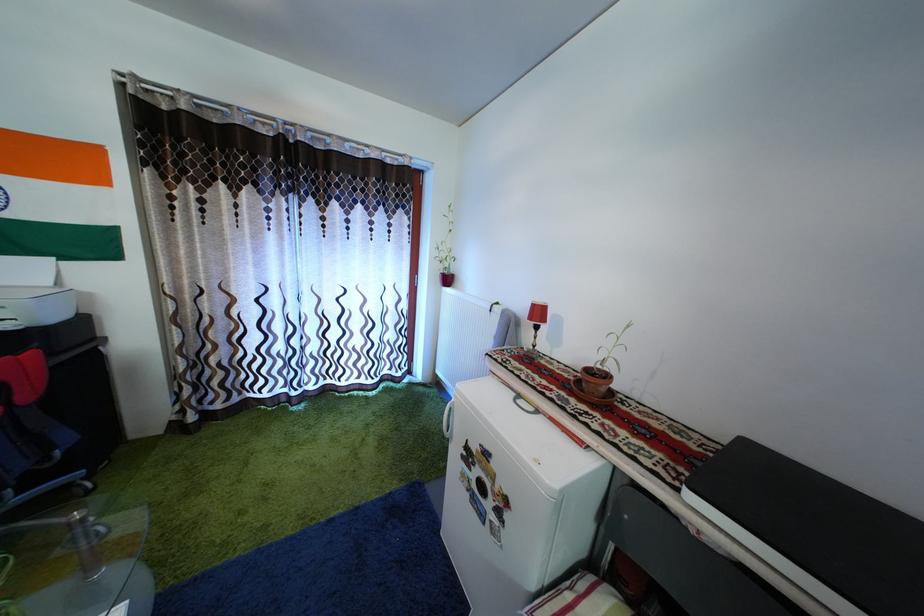
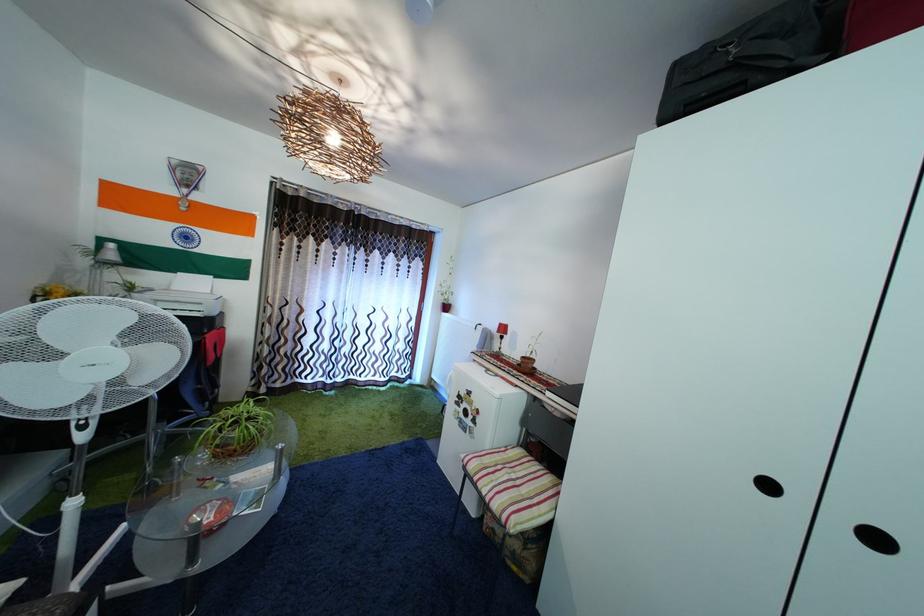
Where in the second image is the point corresponding to (337,389) from the first image?

(359, 384)